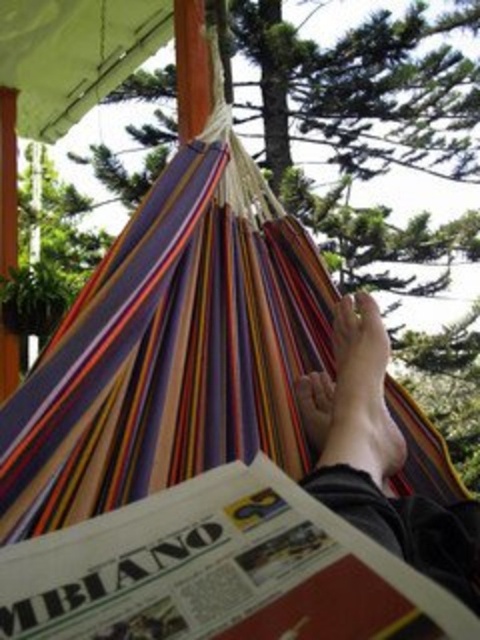
You are a photographer trying to capture a closeup of the multicolored fabric feet at center and the smooth skin foot at lower center in the scene. Can you fit both objects into your camera frame without moving the camera? The camera has a minimum focus distance of 1 inch.

The multicolored fabric feet at center and smooth skin foot at lower center are 0.82 inches apart from each other. Since the minimum focus distance is 1 inch, the camera can capture both objects in the frame without moving it because the distance between them is less than the required focus distance.

You are standing in the scene and want to place a small pillow between the multicolored fabric feet at center and the smooth skin foot at lower center. Which direction should you move the pillow to place it correctly?

The multicolored fabric feet at center is to the right of the smooth skin foot at lower center, so you should move the pillow to the left towards the smooth skin foot at lower center.

You are a photographer trying to capture the smooth skin foot at lower center. Since the multicolored fabric feet at center is blocking the view, can you move the fabric to the side to get a clear shot?

The multicolored fabric feet at center is positioned under the smooth skin foot at lower center, so you can move the fabric to the side to get a clear shot.